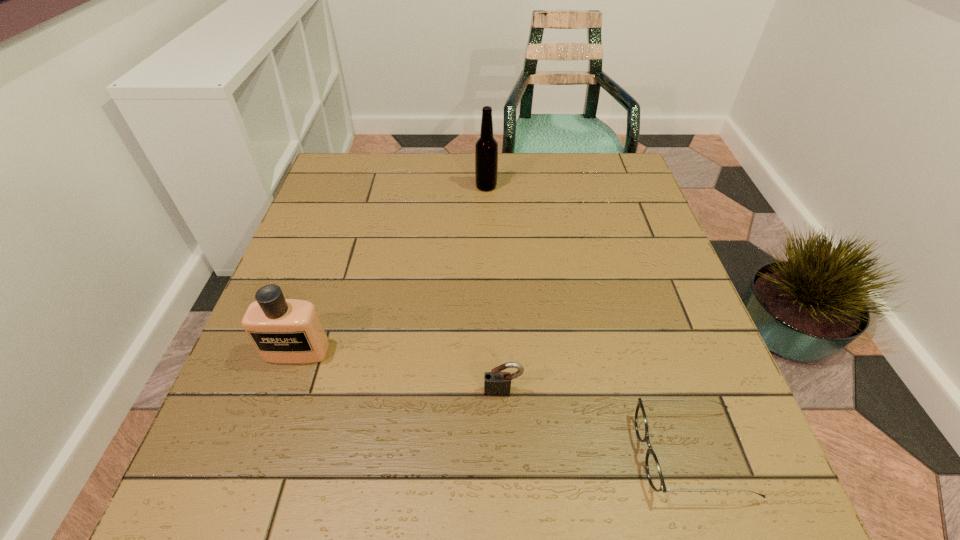
Where is `beer bottle`? The height and width of the screenshot is (540, 960). beer bottle is located at coordinates (486, 148).

At what (x,y) coordinates should I click in order to perform the action: click on the farthest object. Please return your answer as a coordinate pair (x, y). This screenshot has height=540, width=960. Looking at the image, I should click on (486, 148).

Find the location of a particular element. The height and width of the screenshot is (540, 960). the third shortest object is located at coordinates (289, 331).

This screenshot has height=540, width=960. I want to click on the leftmost object, so click(289, 331).

You are a GUI agent. You are given a task and a screenshot of the screen. Output one action in this format:
    pyautogui.click(x=<x>, y=<y>)
    Task: Click on the second shortest object
    This screenshot has height=540, width=960.
    Given the screenshot: What is the action you would take?
    pyautogui.click(x=496, y=383)

This screenshot has height=540, width=960. What are the coordinates of `the second nearest object` in the screenshot? It's located at (496, 383).

The width and height of the screenshot is (960, 540). Identify the location of the shortest object. (653, 469).

At what (x,y) coordinates should I click in order to perform the action: click on the rightmost object. Please return your answer as a coordinate pair (x, y). This screenshot has width=960, height=540. Looking at the image, I should click on (653, 469).

Image resolution: width=960 pixels, height=540 pixels. Identify the location of vacant space positioned 0.400m on the left of the farthest object. (335, 186).

At what (x,y) coordinates should I click in order to perform the action: click on vacant space located 0.150m on the front label of the second farthest object. Please return your answer as a coordinate pair (x, y). Looking at the image, I should click on (266, 440).